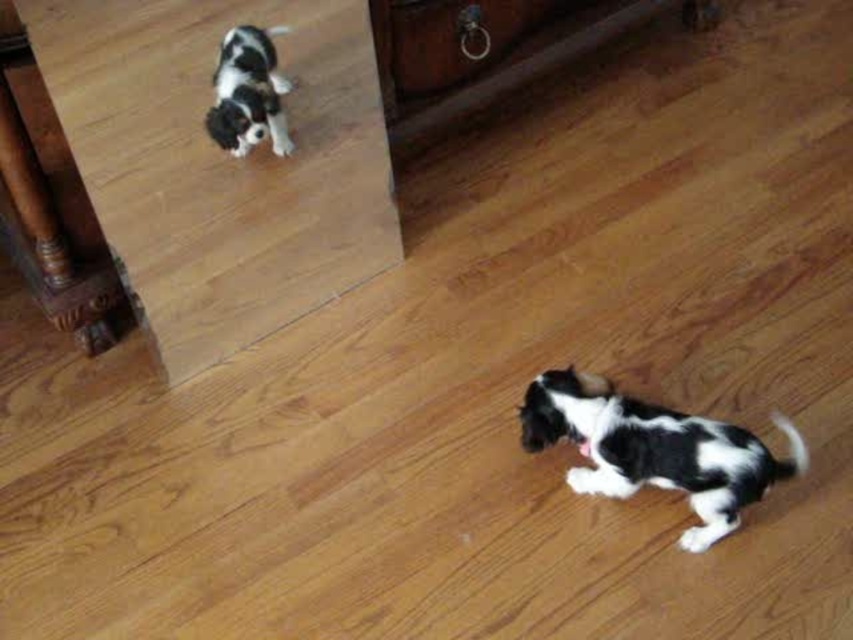
Is matte brown drawer at upper center shorter than black and white fur dog at upper left?

Incorrect, matte brown drawer at upper center's height does not fall short of black and white fur dog at upper left's.

Can you confirm if matte brown drawer at upper center is smaller than black and white fur dog at upper left?

Actually, matte brown drawer at upper center might be larger than black and white fur dog at upper left.

Does point (444, 35) come in front of point (276, 76)?

No, it is not.

In order to click on matte brown drawer at upper center in this screenshot , I will do `click(454, 38)`.

Can you confirm if black and white fur dog at lower right is positioned below black and white fur dog at upper left?

Indeed, black and white fur dog at lower right is positioned under black and white fur dog at upper left.

Who is shorter, black and white fur dog at lower right or black and white fur dog at upper left?

With less height is black and white fur dog at upper left.

What are the coordinates of `black and white fur dog at lower right` in the screenshot? It's located at (654, 449).

Looking at this image, between black and white fur dog at lower right and matte brown drawer at upper center, which one has less height?

With less height is matte brown drawer at upper center.

Describe the element at coordinates (654, 449) in the screenshot. Image resolution: width=853 pixels, height=640 pixels. I see `black and white fur dog at lower right` at that location.

The height and width of the screenshot is (640, 853). What are the coordinates of `black and white fur dog at lower right` in the screenshot? It's located at (654, 449).